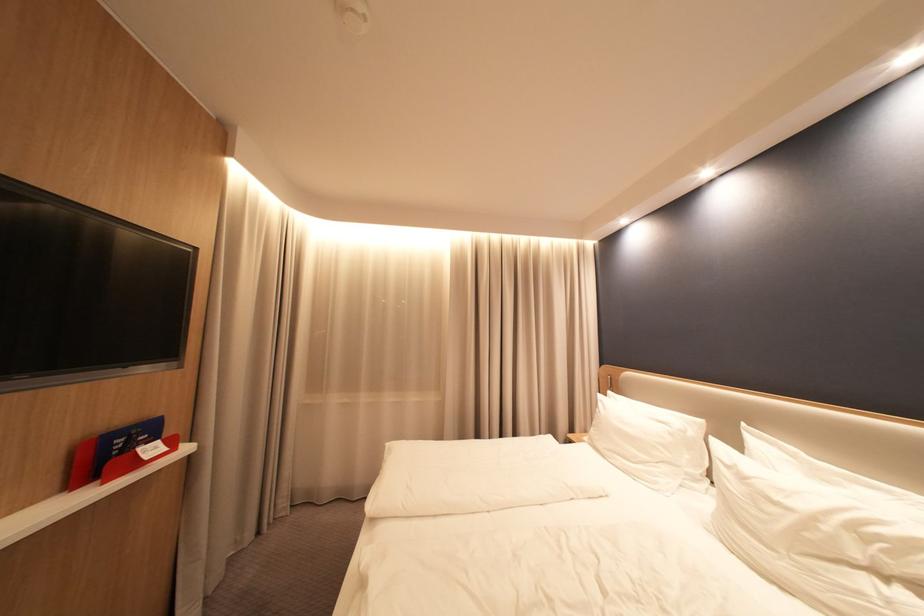
Where is `blue booklet`? The width and height of the screenshot is (924, 616). blue booklet is located at coordinates (129, 437).